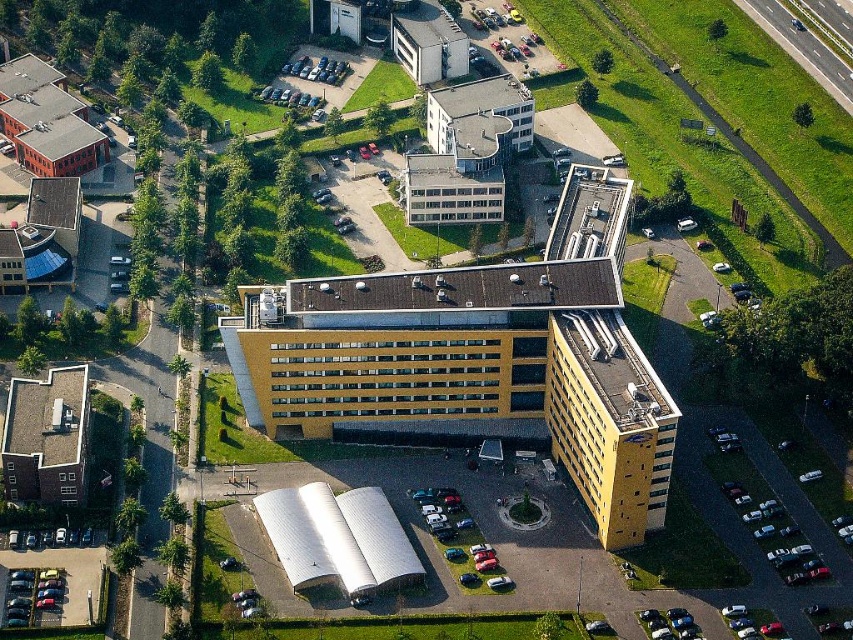
Question: Is the position of green grass at upper right less distant than that of silver metallic antenna at lower center?

Choices:
 (A) yes
 (B) no

Answer: (B)

Question: Which point is farther from the camera taking this photo?

Choices:
 (A) click(578, 580)
 (B) click(817, 81)

Answer: (B)

Question: Is green grass at upper right behind silver metallic antenna at lower center?

Choices:
 (A) yes
 (B) no

Answer: (A)

Question: Can you confirm if green grass at upper right is smaller than silver metallic antenna at lower center?

Choices:
 (A) yes
 (B) no

Answer: (B)